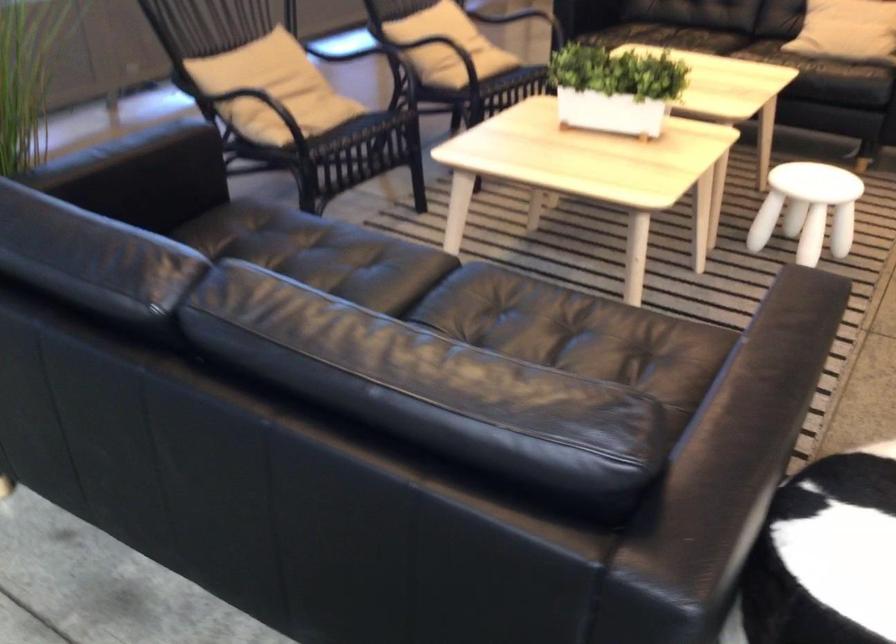
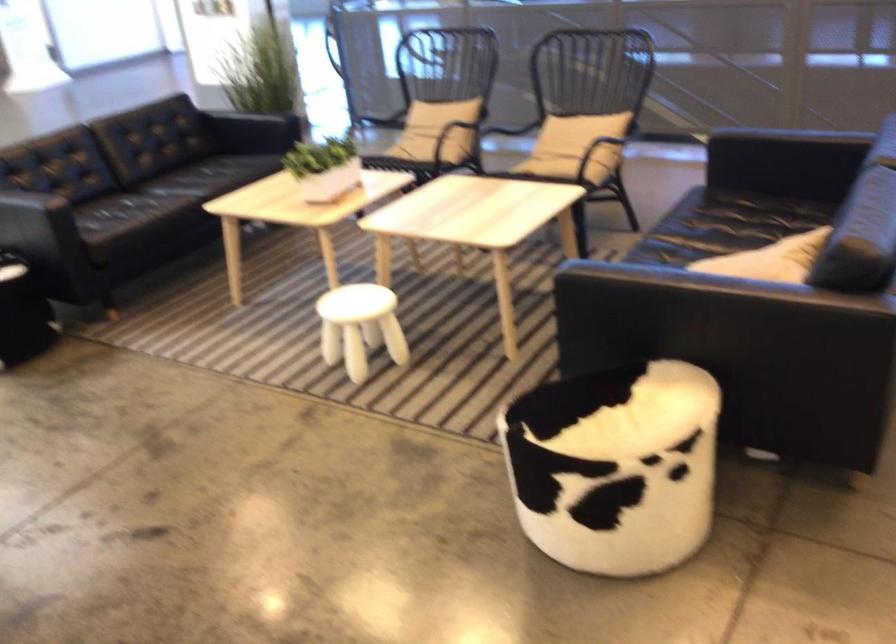
Where in the second image is the point corresponding to (x=326, y=84) from the first image?

(440, 128)